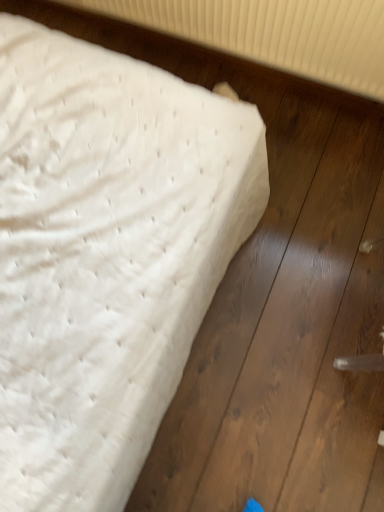
What do you see at coordinates (106, 255) in the screenshot? I see `white quilted mattress at upper left` at bounding box center [106, 255].

Where is `white quilted mattress at upper left`? white quilted mattress at upper left is located at coordinates (106, 255).

Where is `white textured radiator at upper center`? white textured radiator at upper center is located at coordinates (275, 34).

Describe the element at coordinates (275, 34) in the screenshot. I see `white textured radiator at upper center` at that location.

I want to click on white quilted mattress at upper left, so click(106, 255).

Can you confirm if white quilted mattress at upper left is positioned to the right of white textured radiator at upper center?

In fact, white quilted mattress at upper left is to the left of white textured radiator at upper center.

Which is behind, white quilted mattress at upper left or white textured radiator at upper center?

white textured radiator at upper center.

Is point (6, 311) more distant than point (306, 69)?

No, it is not.

From the image's perspective, is white quilted mattress at upper left positioned above or below white textured radiator at upper center?

white quilted mattress at upper left is below white textured radiator at upper center.

From a real-world perspective, is white quilted mattress at upper left below white textured radiator at upper center?

Yes, from a real-world perspective, white quilted mattress at upper left is below white textured radiator at upper center.

Can you confirm if white quilted mattress at upper left is thinner than white textured radiator at upper center?

No, white quilted mattress at upper left is not thinner than white textured radiator at upper center.

Considering the sizes of white quilted mattress at upper left and white textured radiator at upper center in the image, is white quilted mattress at upper left taller or shorter than white textured radiator at upper center?

Considering their sizes, white quilted mattress at upper left has less height than white textured radiator at upper center.

In the scene shown: Which of these two, white quilted mattress at upper left or white textured radiator at upper center, is bigger?

white quilted mattress at upper left is bigger.

Is white quilted mattress at upper left outside of white textured radiator at upper center?

Yes, white quilted mattress at upper left is outside of white textured radiator at upper center.

Does white quilted mattress at upper left touch white textured radiator at upper center?

No, white quilted mattress at upper left is not in contact with white textured radiator at upper center.

Could you tell me if white quilted mattress at upper left is facing white textured radiator at upper center?

No, white quilted mattress at upper left is not oriented towards white textured radiator at upper center.

What's the angular difference between white quilted mattress at upper left and white textured radiator at upper center's facing directions?

There is a 0.0446-degree angle between the facing directions of white quilted mattress at upper left and white textured radiator at upper center.

How distant is white quilted mattress at upper left from white textured radiator at upper center?

24.75 inches.

Find the location of a particular element. Image resolution: width=384 pixels, height=512 pixels. bed below the white textured radiator at upper center (from the image's perspective) is located at coordinates pos(106,255).

Which is more to the right, white textured radiator at upper center or white quilted mattress at upper left?

white textured radiator at upper center is more to the right.

Considering the relative positions of white textured radiator at upper center and white quilted mattress at upper left in the image provided, is white textured radiator at upper center behind white quilted mattress at upper left?

Yes, the depth of white textured radiator at upper center is greater than that of white quilted mattress at upper left.

Which point is more forward, (328, 51) or (15, 275)?

Positioned in front is point (15, 275).

From the image's perspective, between white textured radiator at upper center and white quilted mattress at upper left, which one is located above?

From the image's view, white textured radiator at upper center is above.

From a real-world perspective, is white textured radiator at upper center located beneath white quilted mattress at upper left?

No, from a real-world perspective, white textured radiator at upper center is not under white quilted mattress at upper left.

Does white textured radiator at upper center have a greater width compared to white quilted mattress at upper left?

Incorrect, the width of white textured radiator at upper center does not surpass that of white quilted mattress at upper left.

Is white textured radiator at upper center taller or shorter than white quilted mattress at upper left?

white textured radiator at upper center is taller than white quilted mattress at upper left.

Considering the sizes of objects white textured radiator at upper center and white quilted mattress at upper left in the image provided, who is smaller, white textured radiator at upper center or white quilted mattress at upper left?

white textured radiator at upper center is smaller.

Looking at this image, can we say white textured radiator at upper center lies outside white quilted mattress at upper left?

That's correct, white textured radiator at upper center is outside of white quilted mattress at upper left.

Are white textured radiator at upper center and white quilted mattress at upper left located far from each other?

white textured radiator at upper center is near white quilted mattress at upper left, not far away.

Is white textured radiator at upper center looking in the opposite direction of white quilted mattress at upper left?

white textured radiator at upper center does not have its back to white quilted mattress at upper left.

Looking at this image, what's the angular difference between white textured radiator at upper center and white quilted mattress at upper left's facing directions?

The angle between the facing direction of white textured radiator at upper center and the facing direction of white quilted mattress at upper left is 0.0446 degrees.

Could you measure the distance between white textured radiator at upper center and white quilted mattress at upper left?

The distance of white textured radiator at upper center from white quilted mattress at upper left is 24.75 inches.

Identify the location of radiator behind the white quilted mattress at upper left. (275, 34).

I want to click on radiator located on the right of white quilted mattress at upper left, so click(275, 34).

There is a white quilted mattress at upper left. Where is `radiator above it (from a real-world perspective)`? radiator above it (from a real-world perspective) is located at coordinates (275, 34).